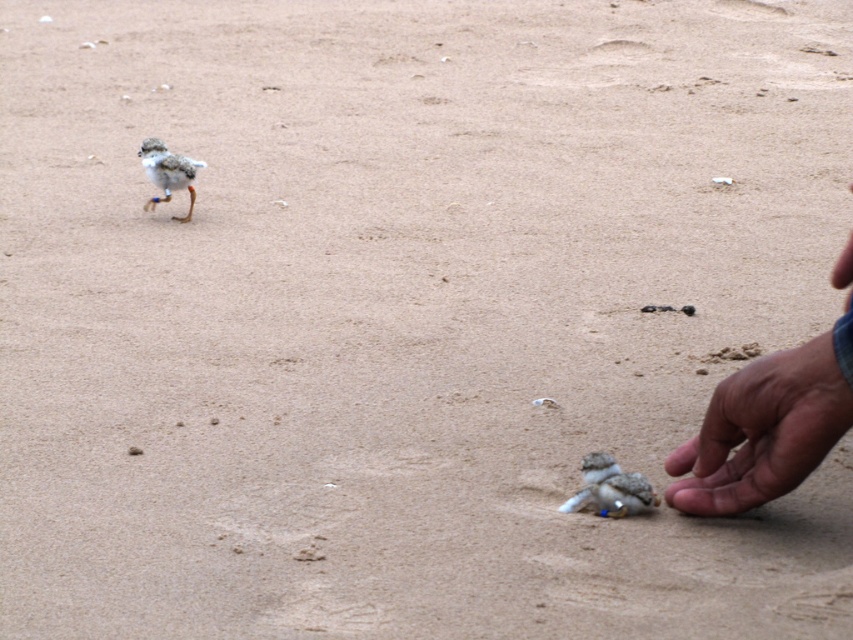
Question: Which point appears farthest from the camera in this image?

Choices:
 (A) (631, 497)
 (B) (171, 188)

Answer: (B)

Question: Which point is closer to the camera taking this photo?

Choices:
 (A) (759, 484)
 (B) (167, 193)
 (C) (621, 483)

Answer: (A)

Question: In this image, where is brown skin at lower right located relative to speckled feathered bird at upper left?

Choices:
 (A) below
 (B) above

Answer: (A)

Question: Which point is closer to the camera taking this photo?

Choices:
 (A) (158, 152)
 (B) (787, 483)

Answer: (B)

Question: Is speckled feathered bird at lower center further to camera compared to speckled feathered bird at upper left?

Choices:
 (A) yes
 (B) no

Answer: (B)

Question: Is brown skin at lower right to the right of speckled feathered bird at upper left from the viewer's perspective?

Choices:
 (A) yes
 (B) no

Answer: (A)